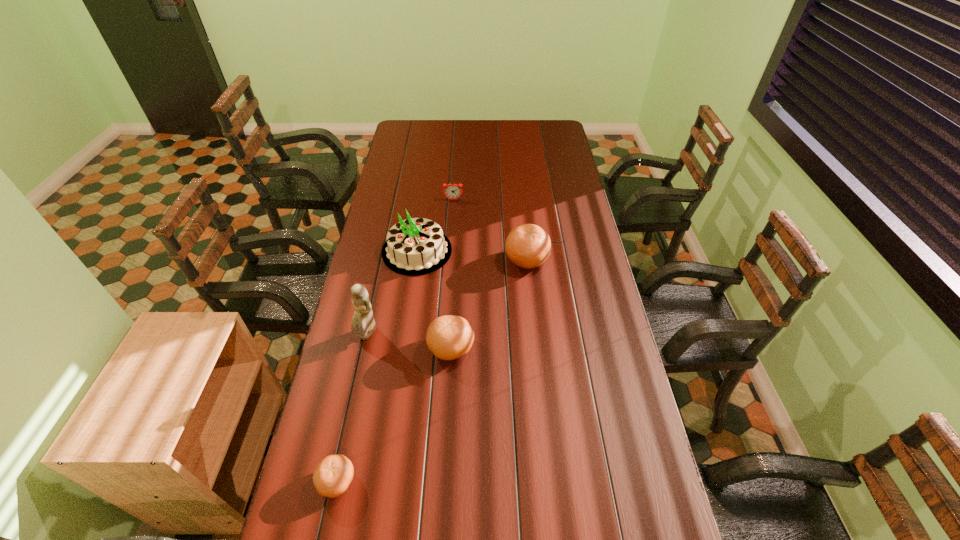
Find the location of a particular element. This screenshot has height=540, width=960. free region located on the front of the fourth tallest object is located at coordinates tap(444, 462).

Where is `vacant space located on the back of the rightmost clementine`? vacant space located on the back of the rightmost clementine is located at coordinates (524, 233).

The image size is (960, 540). Identify the location of free space located 0.180m on the front-facing side of the alarm clock. (451, 227).

The height and width of the screenshot is (540, 960). In order to click on vacant region located on the front-facing side of the figurine in this screenshot , I will do `click(354, 392)`.

Locate an element on the screen. vacant area situated on the front of the birthday cake is located at coordinates (402, 354).

At what (x,y) coordinates should I click in order to perform the action: click on object that is positioned at the near edge. Please return your answer as a coordinate pair (x, y). This screenshot has height=540, width=960. Looking at the image, I should click on (333, 475).

The width and height of the screenshot is (960, 540). What are the coordinates of `clementine situated at the left edge` in the screenshot? It's located at (333, 475).

Identify the location of figurine present at the left edge. (363, 324).

You are a GUI agent. You are given a task and a screenshot of the screen. Output one action in this format:
    pyautogui.click(x=<x>, y=<y>)
    Task: Click on the birthday cake present at the left edge
    This screenshot has height=540, width=960.
    Given the screenshot: What is the action you would take?
    pyautogui.click(x=415, y=246)

This screenshot has width=960, height=540. I want to click on object at the near left corner, so click(333, 475).